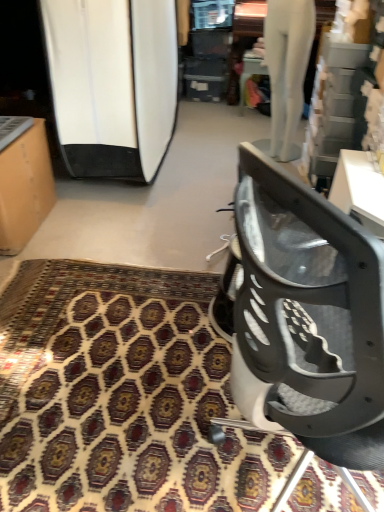
Locate an element on the screen. The width and height of the screenshot is (384, 512). patterned carpet at center is located at coordinates 122,396.

The image size is (384, 512). Find the location of `white glossy surfboard at left`. white glossy surfboard at left is located at coordinates (112, 83).

Considering the points (36, 148) and (134, 323), which point is in front, point (36, 148) or point (134, 323)?

Positioned in front is point (134, 323).

From a real-world perspective, is matte cardboard box at left under patterned carpet at center?

No, from a real-world perspective, matte cardboard box at left is not beneath patterned carpet at center.

Is matte cardboard box at left taller than patterned carpet at center?

Yes, matte cardboard box at left is taller than patterned carpet at center.

From the image's perspective, is matte cardboard box at left located above or below patterned carpet at center?

From the image's perspective, matte cardboard box at left appears above patterned carpet at center.

Is point (16, 294) more distant than point (337, 259)?

Yes, it is behind point (337, 259).

Consider the image. Considering the positions of objects patterned carpet at center and metallic gray chair at lower right in the image provided, who is more to the right, patterned carpet at center or metallic gray chair at lower right?

metallic gray chair at lower right is more to the right.

Looking at the image, does patterned carpet at center seem bigger or smaller compared to metallic gray chair at lower right?

Considering their sizes, patterned carpet at center takes up less space than metallic gray chair at lower right.

Can you tell me how much white glossy surfboard at left and matte cardboard box at left differ in facing direction?

90.5 degrees.

Where is `furniture in front of the white glossy surfboard at left`? furniture in front of the white glossy surfboard at left is located at coordinates (25, 187).

Measure the distance from white glossy surfboard at left to matte cardboard box at left.

A distance of 19.19 inches exists between white glossy surfboard at left and matte cardboard box at left.

Is white glossy surfboard at left in front of matte cardboard box at left?

No, white glossy surfboard at left is further to the viewer.

Is metallic gray chair at lower right positioned in front of white glossy surfboard at left?

Yes, it is in front of white glossy surfboard at left.

Which is farther, (345, 283) or (76, 118)?

Point (76, 118)

Is metallic gray chair at lower right bigger or smaller than white glossy surfboard at left?

In the image, metallic gray chair at lower right appears to be smaller than white glossy surfboard at left.

From the image's perspective, is metallic gray chair at lower right beneath white glossy surfboard at left?

Yes, from the image's perspective, metallic gray chair at lower right is beneath white glossy surfboard at left.

Does patterned carpet at center have a greater height compared to white glossy surfboard at left?

Incorrect, the height of patterned carpet at center is not larger of that of white glossy surfboard at left.

Which is behind, patterned carpet at center or white glossy surfboard at left?

white glossy surfboard at left is behind.

Which object is wider, patterned carpet at center or white glossy surfboard at left?

Wider between the two is white glossy surfboard at left.

Locate an element on the screen. The width and height of the screenshot is (384, 512). chair above the patterned carpet at center (from the image's perspective) is located at coordinates (307, 324).

Looking at this image, can you tell me how much metallic gray chair at lower right and patterned carpet at center differ in facing direction?

The facing directions of metallic gray chair at lower right and patterned carpet at center are 121 degrees apart.

Is metallic gray chair at lower right aimed at patterned carpet at center?

No, metallic gray chair at lower right is not turned towards patterned carpet at center.

Which of these two, metallic gray chair at lower right or patterned carpet at center, is bigger?

metallic gray chair at lower right.

Which is closer, [30,155] or [341,213]?

Point [30,155].

Considering the sizes of objects matte cardboard box at left and metallic gray chair at lower right in the image provided, who is wider, matte cardboard box at left or metallic gray chair at lower right?

Wider between the two is metallic gray chair at lower right.

Identify the location of furniture on the left of patterned carpet at center. (25, 187).

At what (x,y) coordinates should I click in order to perform the action: click on mat below the metallic gray chair at lower right (from the image's perspective). Please return your answer as a coordinate pair (x, y). This screenshot has height=512, width=384. Looking at the image, I should click on (122, 396).

Which object lies nearer to the anchor point metallic gray chair at lower right, patterned carpet at center or white glossy surfboard at left?

Among the two, patterned carpet at center is located nearer to metallic gray chair at lower right.

Estimate the real-world distances between objects in this image. Which object is closer to white glossy surfboard at left, metallic gray chair at lower right or patterned carpet at center?

Based on the image, patterned carpet at center appears to be nearer to white glossy surfboard at left.

Considering their positions, is white glossy surfboard at left positioned further to matte cardboard box at left than metallic gray chair at lower right?

Among the two, metallic gray chair at lower right is located further to matte cardboard box at left.

From the image, which object appears to be farther from metallic gray chair at lower right, white glossy surfboard at left or patterned carpet at center?

white glossy surfboard at left is positioned further to the anchor metallic gray chair at lower right.

Looking at the image, which one is located closer to metallic gray chair at lower right, patterned carpet at center or matte cardboard box at left?

patterned carpet at center is closer to metallic gray chair at lower right.

Estimate the real-world distances between objects in this image. Which object is closer to white glossy surfboard at left, matte cardboard box at left or metallic gray chair at lower right?

Based on the image, matte cardboard box at left appears to be nearer to white glossy surfboard at left.

Based on their spatial positions, is matte cardboard box at left or patterned carpet at center closer to white glossy surfboard at left?

The object closer to white glossy surfboard at left is matte cardboard box at left.

Which object lies further to the anchor point matte cardboard box at left, metallic gray chair at lower right or patterned carpet at center?

Based on the image, metallic gray chair at lower right appears to be further to matte cardboard box at left.

Locate an element on the screen. This screenshot has width=384, height=512. mat between matte cardboard box at left and metallic gray chair at lower right is located at coordinates (x=122, y=396).

Identify the location of furniture that lies between white glossy surfboard at left and patterned carpet at center from top to bottom. [25, 187].

Where is `furniture between metallic gray chair at lower right and white glossy surfboard at left from front to back`? The image size is (384, 512). furniture between metallic gray chair at lower right and white glossy surfboard at left from front to back is located at coordinates (25, 187).

Locate an element on the screen. The image size is (384, 512). chair that lies between white glossy surfboard at left and patterned carpet at center from top to bottom is located at coordinates (307, 324).